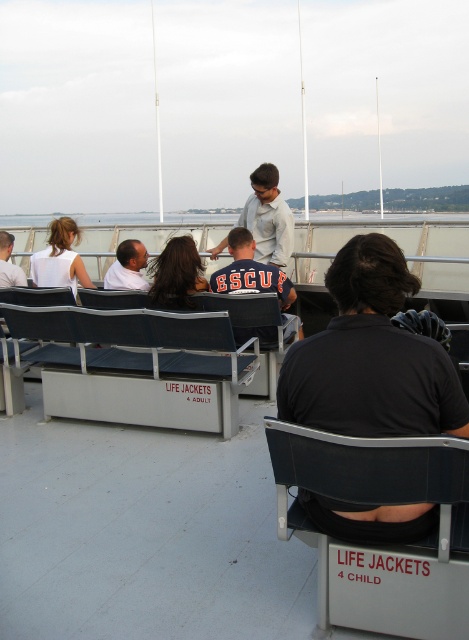
Does matte black chair at center appear over dark blue jersey at center?

No, matte black chair at center is not above dark blue jersey at center.

Is point (280, 323) behind point (242, 289)?

No, it is not.

Locate an element on the screen. The image size is (469, 640). matte black chair at center is located at coordinates (256, 330).

Does black fabric shirt at center appear over light gray shirt at center?

No, black fabric shirt at center is not above light gray shirt at center.

Between black fabric shirt at center and light gray shirt at center, which one is positioned lower?

Positioned lower is black fabric shirt at center.

Between point (449, 380) and point (226, 243), which one is positioned in front?

Point (449, 380) is in front.

At what (x,y) coordinates should I click in order to perform the action: click on black fabric shirt at center. Please return your answer as a coordinate pair (x, y). The width and height of the screenshot is (469, 640). Looking at the image, I should click on (370, 356).

Between point (437, 580) and point (38, 273), which one is positioned behind?

The point (38, 273) is more distant.

I want to click on black plastic chair at lower right, so click(x=381, y=545).

Find the location of a particular element. This screenshot has height=640, width=469. black plastic chair at lower right is located at coordinates (381, 545).